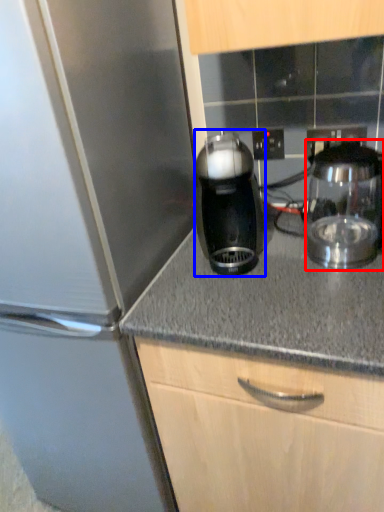
Question: Among these objects, which one is farthest to the camera, kitchen appliance (highlighted by a red box) or kitchen appliance (highlighted by a blue box)?

Choices:
 (A) kitchen appliance
 (B) kitchen appliance

Answer: (B)